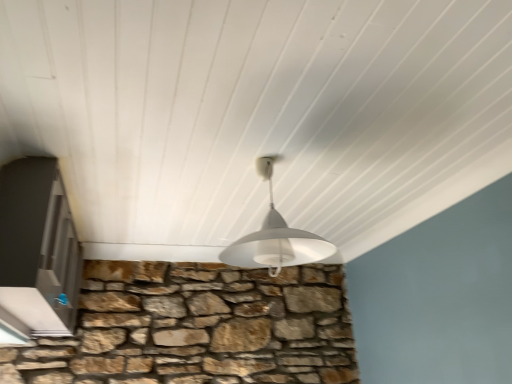
Question: Relative to white glossy door at left, is white matte lampshade at center in front or behind?

Choices:
 (A) front
 (B) behind

Answer: (A)

Question: Is white matte lampshade at center situated inside white glossy door at left or outside?

Choices:
 (A) inside
 (B) outside

Answer: (B)

Question: Is white matte lampshade at center taller or shorter than white glossy door at left?

Choices:
 (A) short
 (B) tall

Answer: (A)

Question: Is white glossy door at left in front of or behind white matte lampshade at center in the image?

Choices:
 (A) behind
 (B) front

Answer: (A)

Question: From the image's perspective, is white glossy door at left located above or below white matte lampshade at center?

Choices:
 (A) above
 (B) below

Answer: (B)

Question: In terms of height, does white glossy door at left look taller or shorter compared to white matte lampshade at center?

Choices:
 (A) tall
 (B) short

Answer: (A)

Question: Considering the positions of white glossy door at left and white matte lampshade at center in the image, is white glossy door at left bigger or smaller than white matte lampshade at center?

Choices:
 (A) big
 (B) small

Answer: (A)